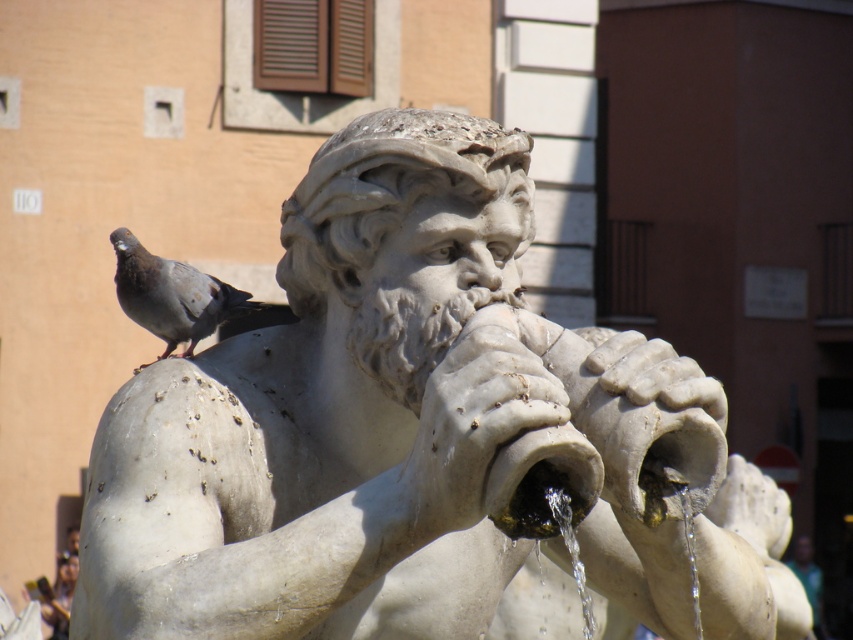
You are standing in front of a classical fountain with a statue of a bearded man playing a double flute. The statue is at the center of the fountain. There is a point marked at coordinates (x=378, y=420). Is this point located on the statue?

The white marble statue at center is represented by point (x=378, y=420), so yes, the point is located on the statue.

You are a photographer trying to capture the statue and the pigeon in the same frame. Based on their positions, will the gray matte pigeon at upper left be partially hidden by the white marble statue at center?

The white marble statue at center is in front of the gray matte pigeon at upper left, so yes, the pigeon will be partially hidden by the statue.

You are standing in front of the fountain and want to take a photo of both the white marble statue at center and the gray matte pigeon at upper left. Which object should you adjust your camera to focus on first to ensure both are in the frame?

You should focus on the white marble statue at center first because it is to the right of the gray matte pigeon at upper left, so adjusting the camera to include both requires starting with the statue on the right and then ensuring the pigeon on the left is also in view.